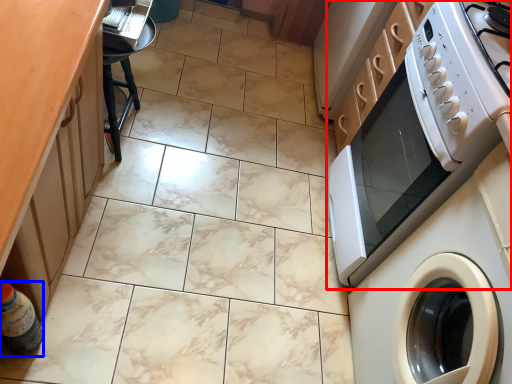
Question: Among these objects, which one is farthest to the camera, home appliance (highlighted by a red box) or bottle (highlighted by a blue box)?

Choices:
 (A) home appliance
 (B) bottle

Answer: (A)